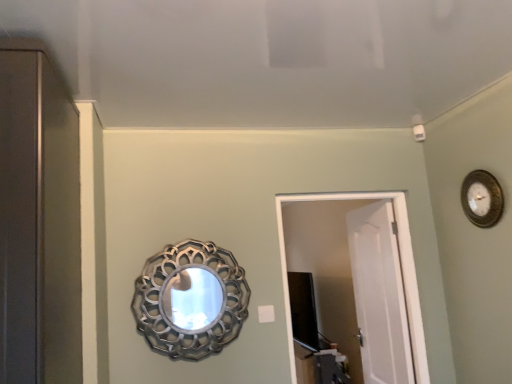
Question: Looking at the image, does black glossy tv at center seem bigger or smaller compared to white matte door at center, the first door in the back-to-front sequence?

Choices:
 (A) small
 (B) big

Answer: (B)

Question: From the image's perspective, is black glossy tv at center positioned above or below white matte door at center, the first door in the back-to-front sequence?

Choices:
 (A) below
 (B) above

Answer: (A)

Question: Estimate the real-world distances between objects in this image. Which object is farther from the metallic silver mirror at center?

Choices:
 (A) gold textured clock at upper right
 (B) white matte door at center, arranged as the 2th door when viewed from the back
 (C) white plastic light switch at center
 (D) white matte door at center, the first door in the back-to-front sequence
 (E) black glossy tv at center

Answer: (A)

Question: Which object is positioned farthest from the black glossy tv at center?

Choices:
 (A) white plastic light switch at center
 (B) white matte door at center, acting as the second door starting from the front
 (C) white matte door at center, arranged as the 2th door when viewed from the back
 (D) gold textured clock at upper right
 (E) metallic silver mirror at center

Answer: (D)